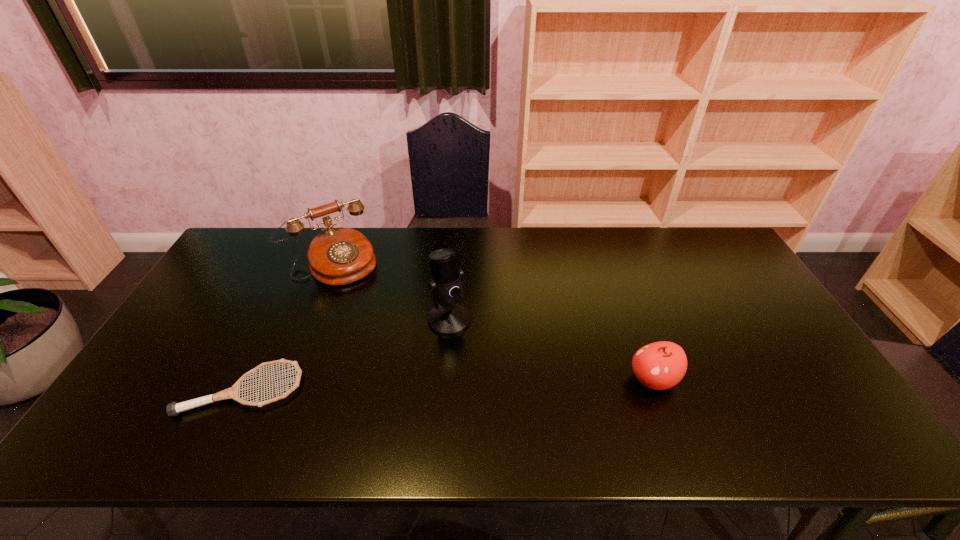
Locate an element on the screen. The image size is (960, 540). free location located 0.160m on the dial of the telephone is located at coordinates [x=372, y=312].

Where is `vacant space situated on the dial of the telephone`? This screenshot has width=960, height=540. vacant space situated on the dial of the telephone is located at coordinates (378, 322).

Where is `free location located 0.090m on the stand of the third nearest object`? free location located 0.090m on the stand of the third nearest object is located at coordinates (468, 358).

What are the coordinates of `blank space located 0.230m on the stand of the third nearest object` in the screenshot? It's located at (488, 400).

What are the coordinates of `vacant area situated on the stand of the third nearest object` in the screenshot? It's located at (490, 403).

At what (x,y) coordinates should I click in order to perform the action: click on object at the far edge. Please return your answer as a coordinate pair (x, y). This screenshot has height=540, width=960. Looking at the image, I should click on pos(337,256).

Where is `tennis racket that is positioned at the near edge`? The image size is (960, 540). tennis racket that is positioned at the near edge is located at coordinates (173, 409).

The height and width of the screenshot is (540, 960). I want to click on apple that is at the near edge, so click(661, 365).

In order to click on object that is at the left edge in this screenshot , I will do `click(173, 409)`.

This screenshot has width=960, height=540. Find the location of `object at the near left corner`. object at the near left corner is located at coordinates (173, 409).